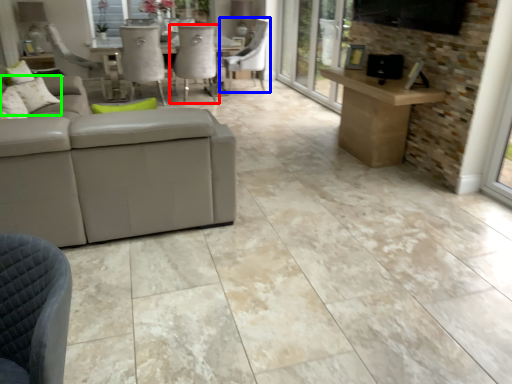
Question: Which is farther away from chair (highlighted by a red box)? chair (highlighted by a blue box) or pillow (highlighted by a green box)?

Choices:
 (A) chair
 (B) pillow

Answer: (B)